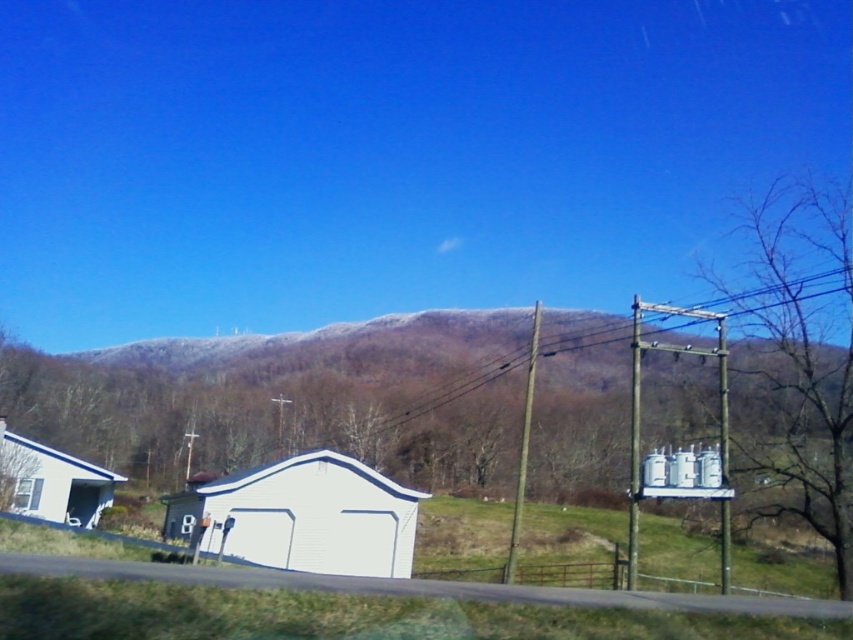
Is point (459, 396) positioned behind point (48, 484)?

That is True.

How much distance is there between brown wooden power line at center and white matte garage at lower left?

A distance of 18.26 meters exists between brown wooden power line at center and white matte garage at lower left.

Which is behind, point (793, 298) or point (45, 452)?

Positioned behind is point (45, 452).

This screenshot has width=853, height=640. Identify the location of brown wooden power line at center. (450, 390).

Which is in front, point (242, 502) or point (39, 481)?

Point (242, 502) is in front.

Between white vinyl garage at center and transparent glass window at lower left, which one is positioned lower?

white vinyl garage at center

Which is behind, point (386, 563) or point (22, 483)?

Positioned behind is point (22, 483).

Find the location of `white vinyl garage at center`. white vinyl garage at center is located at coordinates (305, 516).

Does white vinyl garage at center have a lesser width compared to brown wooden power line at center?

Correct, white vinyl garage at center's width is less than brown wooden power line at center's.

Is white vinyl garage at center below brown wooden power line at center?

Yes, white vinyl garage at center is below brown wooden power line at center.

This screenshot has height=640, width=853. Find the location of `white vinyl garage at center`. white vinyl garage at center is located at coordinates (305, 516).